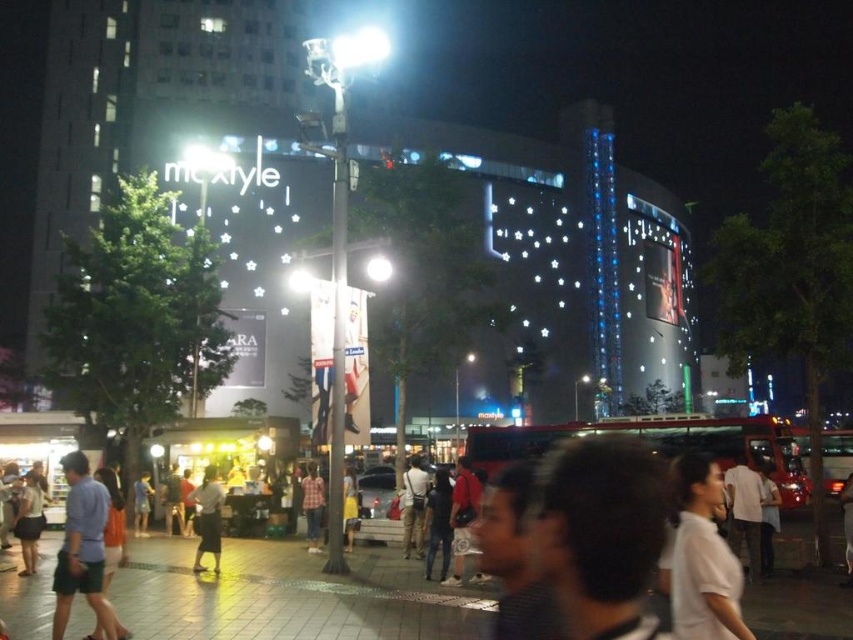
Who is lower down, white matte shirt at center or light gray fabric skirt at center?

light gray fabric skirt at center is lower down.

Is white matte shirt at center closer to the viewer compared to light gray fabric skirt at center?

Yes, it is in front of light gray fabric skirt at center.

Measure the distance between white matte shirt at center and camera.

They are 25.95 meters apart.

Where is `white matte shirt at center`? This screenshot has width=853, height=640. white matte shirt at center is located at coordinates (701, 557).

Which of these two, white matte shirt at center or plaid shirt at center, stands shorter?

With less height is plaid shirt at center.

Between white matte shirt at center and plaid shirt at center, which one is positioned higher?

Positioned higher is white matte shirt at center.

Measure the distance between white matte shirt at center and camera.

A distance of 25.95 meters exists between white matte shirt at center and camera.

This screenshot has height=640, width=853. What are the coordinates of `white matte shirt at center` in the screenshot? It's located at (701, 557).

Measure the distance between light gray fabric skirt at center and camera.

140.83 feet

Does point (202, 481) come farther from viewer compared to point (305, 490)?

That is False.

What do you see at coordinates (207, 518) in the screenshot?
I see `light gray fabric skirt at center` at bounding box center [207, 518].

Identify the location of light gray fabric skirt at center. This screenshot has width=853, height=640. (207, 518).